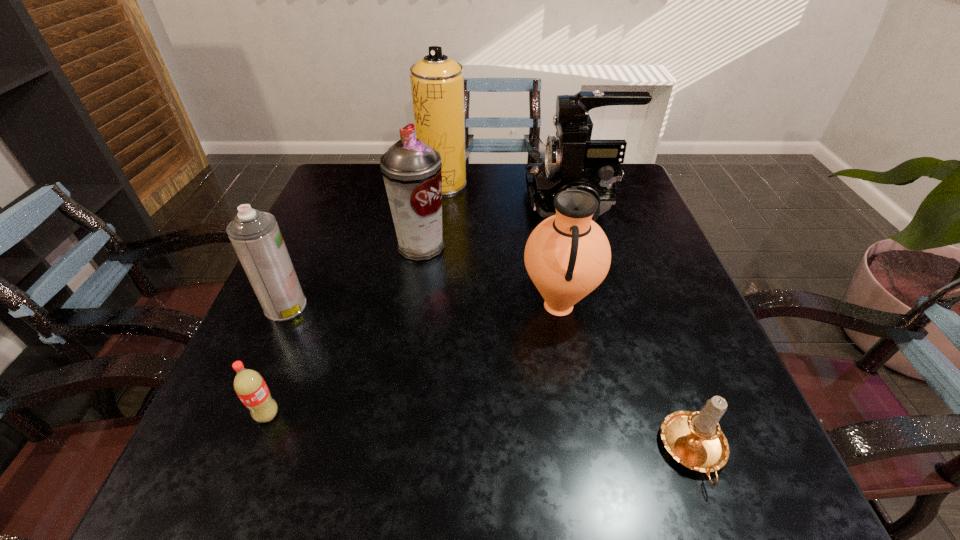
I want to click on the tallest aerosol can, so click(x=437, y=82).

I want to click on the tallest object, so click(x=437, y=82).

Where is `camcorder`? The image size is (960, 540). camcorder is located at coordinates click(571, 158).

Locate an element on the screen. the second nearest aerosol can is located at coordinates (411, 169).

Image resolution: width=960 pixels, height=540 pixels. I want to click on pitcher, so click(567, 256).

Find the location of a particular element. The image size is (960, 540). the nearest aerosol can is located at coordinates (257, 240).

Image resolution: width=960 pixels, height=540 pixels. I want to click on the leftmost aerosol can, so 257,240.

Where is `soda`? soda is located at coordinates (249, 385).

This screenshot has width=960, height=540. In order to click on candle in this screenshot , I will do `click(694, 439)`.

At what (x,y) coordinates should I click in order to perform the action: click on vacant point located on the front of the tallest aerosol can. Please return your answer as a coordinate pair (x, y). The width and height of the screenshot is (960, 540). Looking at the image, I should click on pos(436,253).